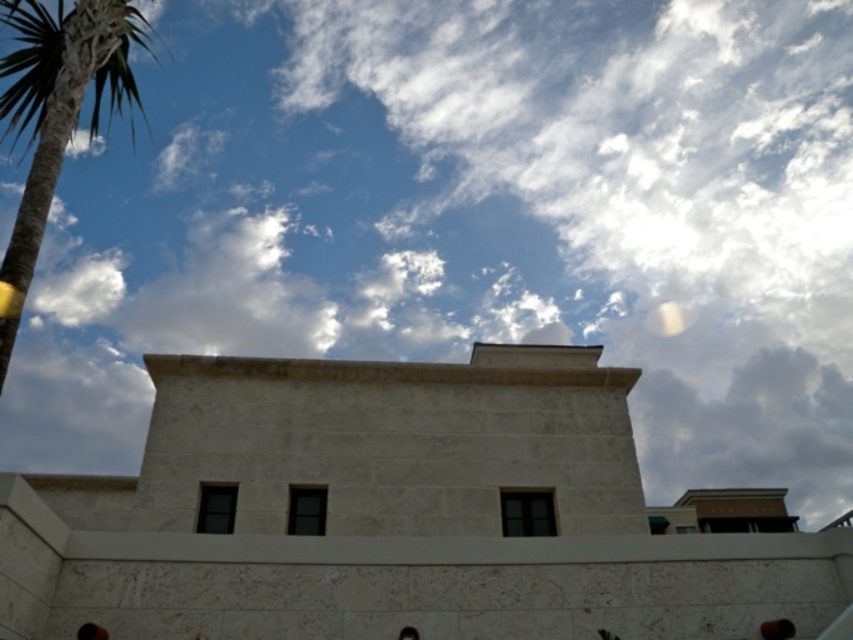
You are standing in front of the building and want to take a photo that includes both the green leafy palm at upper left and the black matte person at lower left. Which object should you position closer to the edge of the frame to ensure both fit in the photo?

Since the green leafy palm at upper left is larger in size than the black matte person at lower left, you should position the green leafy palm at upper left closer to the edge of the frame to ensure both fit in the photo.

You are standing in front of the building and want to take a photo of the green leafy palm at upper left. Where should you position yourself to include it in your shot?

You should position yourself to the left side of the building to capture the green leafy palm at upper left, as it is located at point [56,112] which is on the upper left corner of the image.